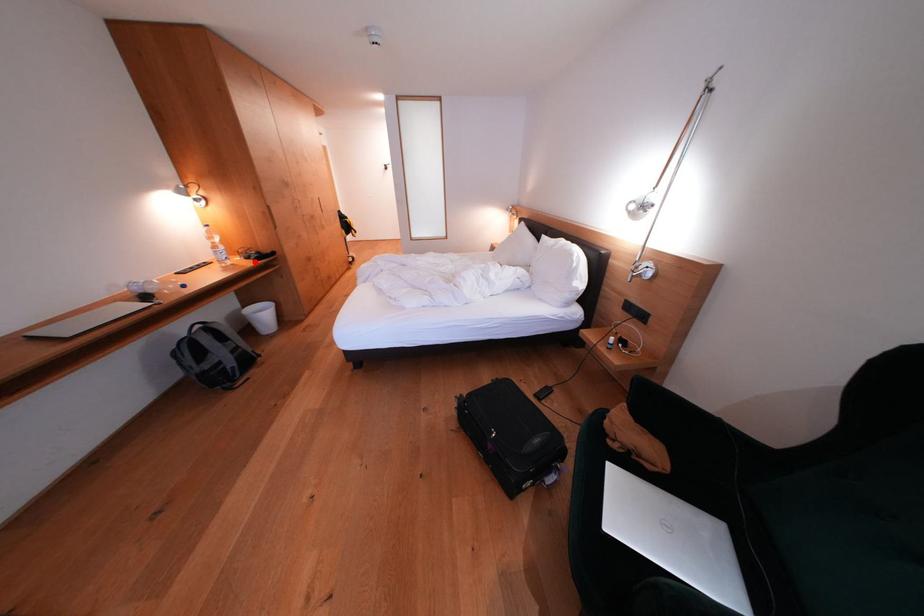
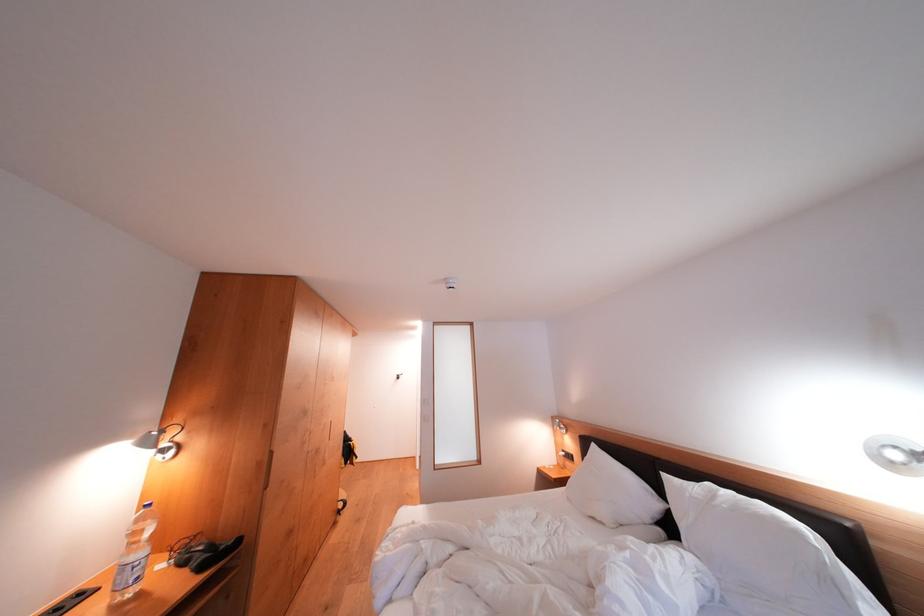
Question: I am providing you with two images of the same scene from different viewpoints. A red point is marked on the first image. Is the red point's position out of view in image 2?

Choices:
 (A) Yes
 (B) No

Answer: (B)